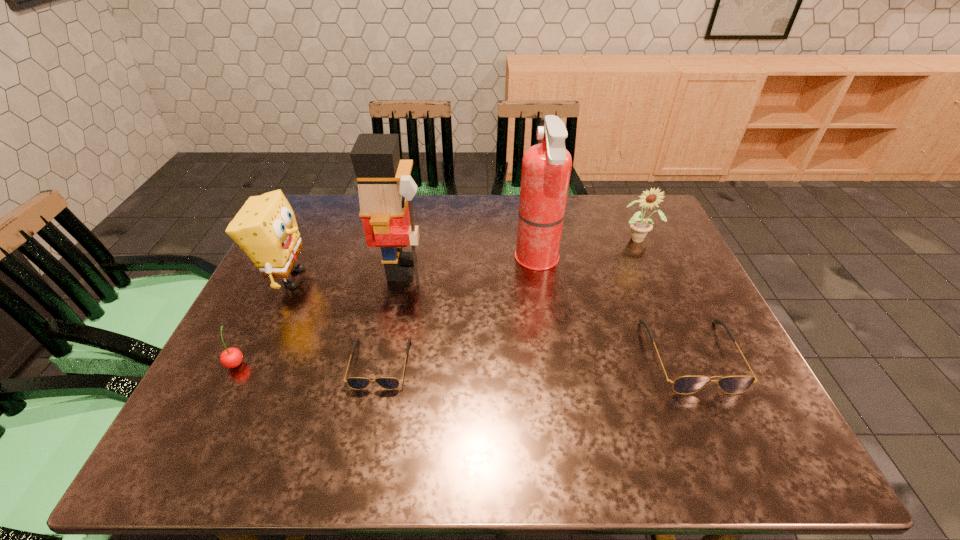
At what (x,y) coordinates should I click in order to perform the action: click on the left sunglasses. Please return your answer as a coordinate pair (x, y). Image resolution: width=960 pixels, height=540 pixels. Looking at the image, I should click on (358, 383).

The image size is (960, 540). Identify the location of the shorter sunglasses. (358, 383).

Find the location of `the second shortest object`. the second shortest object is located at coordinates (690, 384).

Locate an element on the screen. This screenshot has width=960, height=540. the right sunglasses is located at coordinates (690, 384).

The width and height of the screenshot is (960, 540). Find the location of `the fifth object from left to right`. the fifth object from left to right is located at coordinates (546, 167).

The height and width of the screenshot is (540, 960). What are the coordinates of `the third tallest object` in the screenshot? It's located at (265, 228).

Image resolution: width=960 pixels, height=540 pixels. I want to click on the fourth tallest object, so click(x=640, y=227).

This screenshot has width=960, height=540. Identify the location of nutcracker. (386, 189).

Identify the location of cherry. The image size is (960, 540). (231, 357).

This screenshot has width=960, height=540. Find the location of `blank area located 0.190m with the handle and hose on the fire extinguisher`. blank area located 0.190m with the handle and hose on the fire extinguisher is located at coordinates (448, 260).